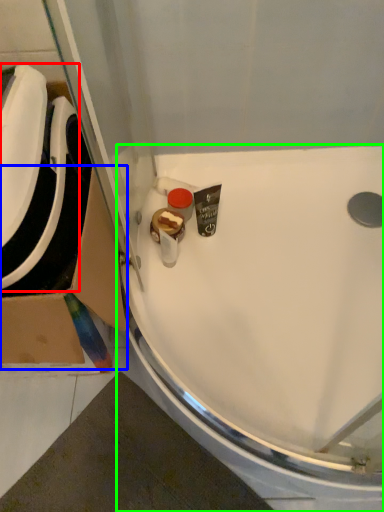
Question: Considering the real-world distances, which object is farthest from sink (highlighted by a red box)? cardboard box (highlighted by a blue box) or sink (highlighted by a green box)?

Choices:
 (A) cardboard box
 (B) sink

Answer: (B)